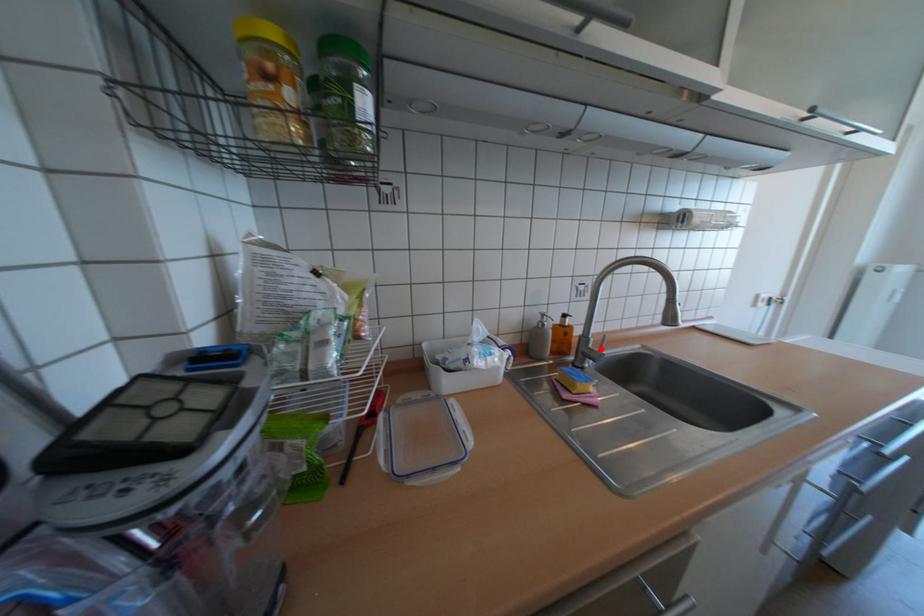
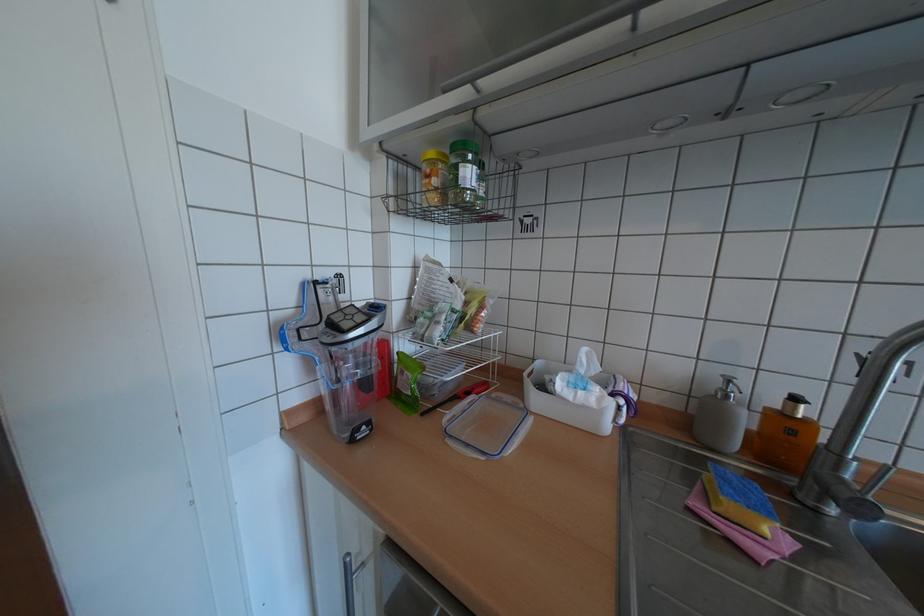
In the second image, find the point that corresponds to the highlighted location in the first image.

(852, 480)